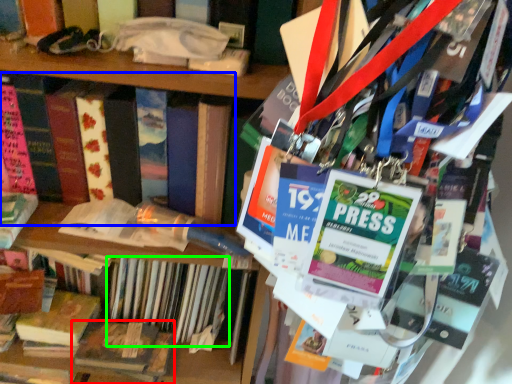
Question: Which object is the farthest from book (highlighted by a red box)? Choose among these: book (highlighted by a blue box) or book (highlighted by a green box).

Choices:
 (A) book
 (B) book

Answer: (A)